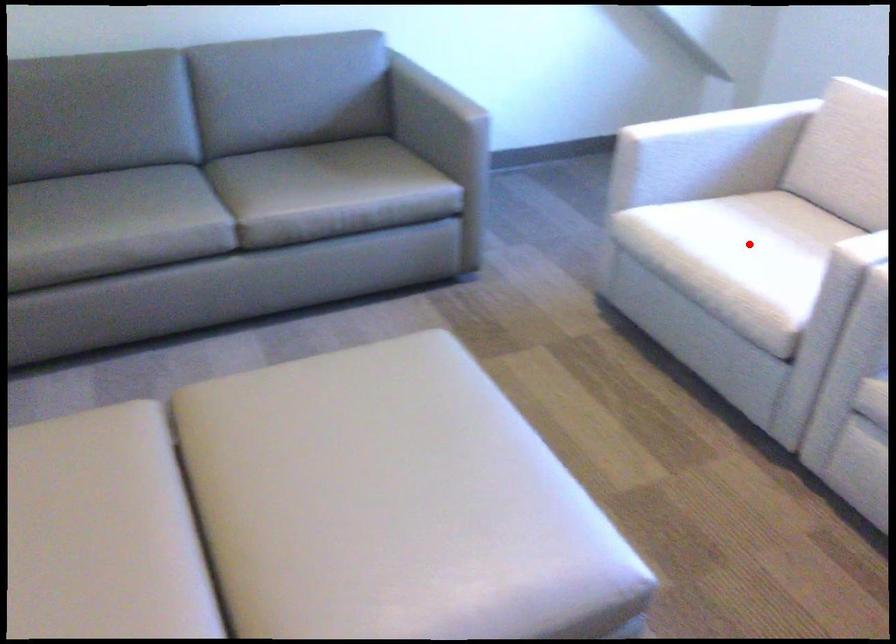
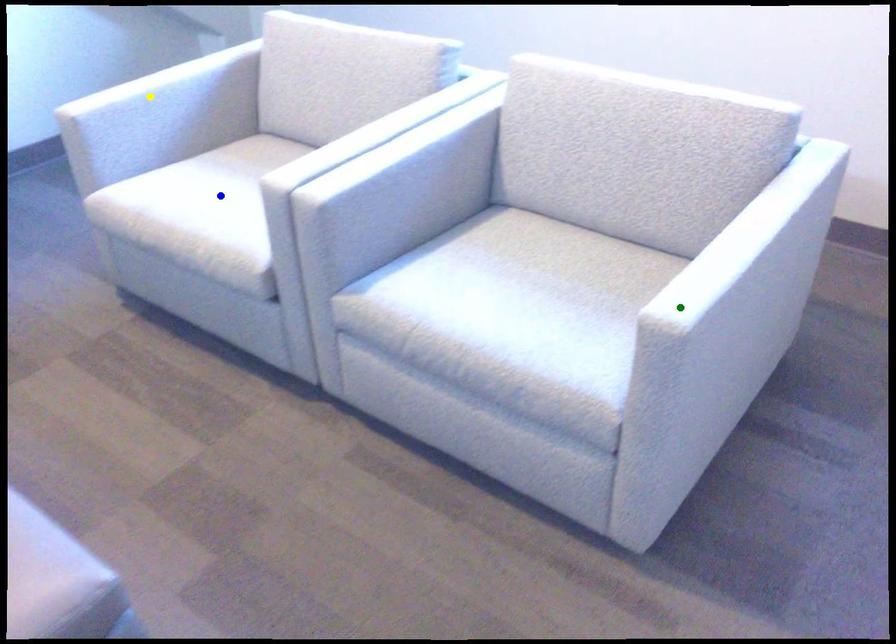
Question: I am providing you with two images of the same scene from different viewpoints. A red point is marked on the first image. You are given multiple points on the second image. Which mark in image 2 goes with the point in image 1?

Choices:
 (A) yellow point
 (B) blue point
 (C) green point

Answer: (B)